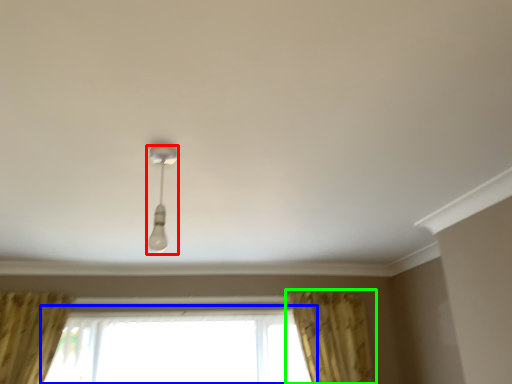
Question: Which object is the farthest from lamp (highlighted by a red box)? Choose among these: window (highlighted by a blue box) or curtain (highlighted by a green box).

Choices:
 (A) window
 (B) curtain

Answer: (B)